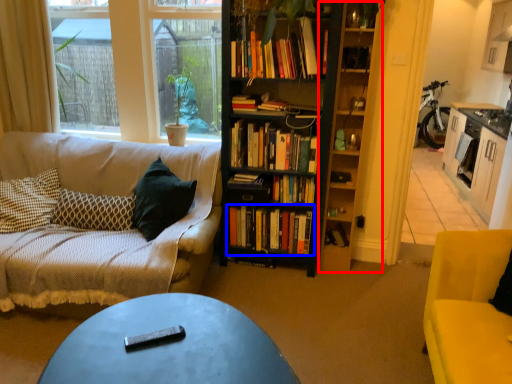
Question: Which object appears closest to the camera in this image, shelf (highlighted by a red box) or book (highlighted by a blue box)?

Choices:
 (A) shelf
 (B) book

Answer: (A)